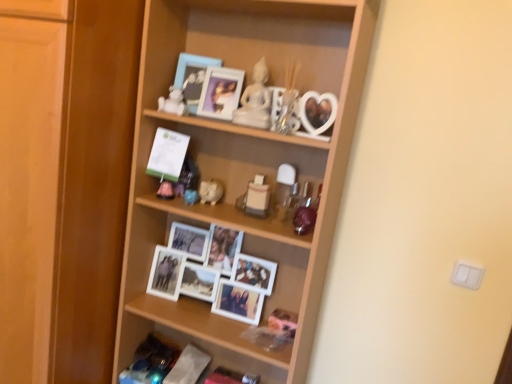
This screenshot has height=384, width=512. What do you see at coordinates (167, 154) in the screenshot?
I see `green paper at center` at bounding box center [167, 154].

Where is `green paper at center`? The height and width of the screenshot is (384, 512). green paper at center is located at coordinates (167, 154).

How much space does white glossy statue at upper center, which is counted as the 1th toy, starting from the top, occupy horizontally?

white glossy statue at upper center, which is counted as the 1th toy, starting from the top, is 1.99 inches in width.

At what (x,y) coordinates should I click in order to perform the action: click on matte plastic toy at center, which ranks as the 1th toy in bottom-to-top order. Please return your answer as a coordinate pair (x, y). The height and width of the screenshot is (384, 512). Looking at the image, I should click on (255, 198).

Locate an element on the screen. This screenshot has height=384, width=512. white matte figurine at upper center, which is counted as the 2th toy, starting from the top is located at coordinates (173, 102).

From the picture: From the image's perspective, between matte plastic toy at center, the third toy ordered from the bottom, and white glossy statue at upper center, the 5th toy positioned from the bottom, which one is located above?

white glossy statue at upper center, the 5th toy positioned from the bottom, from the image's perspective.

Which is correct: matte plastic toy at center, the third toy ordered from the bottom, is inside white glossy statue at upper center, which is counted as the 1th toy, starting from the top, or outside of it?

matte plastic toy at center, the third toy ordered from the bottom, exists outside the volume of white glossy statue at upper center, which is counted as the 1th toy, starting from the top.

Which is more to the left, matte plastic toy at center, the third toy ordered from the bottom, or white glossy statue at upper center, which is counted as the 1th toy, starting from the top?

matte plastic toy at center, the third toy ordered from the bottom, is more to the left.

Which is in front, point (183, 163) or point (267, 71)?

Point (267, 71)

Which is correct: wooden cabinet at left is inside matte plastic toy at center, the third toy ordered from the bottom, or outside of it?

The correct answer is: outside.

You are a GUI agent. You are given a task and a screenshot of the screen. Output one action in this format:
    pyautogui.click(x=<x>, y=<y>)
    Task: Click on the toy that is the 2nd object to the right of the wooden cabinet at left, starting at the anchor
    The image size is (512, 384).
    Given the screenshot: What is the action you would take?
    point(182,182)

From the picture: Is the depth of wooden cabinet at left less than that of matte plastic toy at center, the 3th toy when ordered from top to bottom?

Yes, it is in front of matte plastic toy at center, the 3th toy when ordered from top to bottom.

Is wooden cabinet at left not close to matte plastic toy at center, the 3th toy when ordered from top to bottom?

No, wooden cabinet at left is not far from matte plastic toy at center, the 3th toy when ordered from top to bottom.

Considering the positions of objects white glossy statue at upper center, the 5th toy positioned from the bottom, and wooden cabinet at left in the image provided, who is in front, white glossy statue at upper center, the 5th toy positioned from the bottom, or wooden cabinet at left?

wooden cabinet at left is in front.

Between white glossy statue at upper center, the 5th toy positioned from the bottom, and wooden cabinet at left, which one has less height?

Standing shorter between the two is white glossy statue at upper center, the 5th toy positioned from the bottom.

Is white glossy statue at upper center, which is counted as the 1th toy, starting from the top, bigger or smaller than wooden cabinet at left?

white glossy statue at upper center, which is counted as the 1th toy, starting from the top, is smaller than wooden cabinet at left.

Is the surface of matte plastic picture frame at upper center, which is counted as the 1th picture frame, starting from the right, in direct contact with white glossy piggy bank at center, the second toy positioned from the bottom?

matte plastic picture frame at upper center, which is counted as the 1th picture frame, starting from the right, and white glossy piggy bank at center, the second toy positioned from the bottom, are clearly separated.

How far apart are matte plastic picture frame at upper center, marked as the second picture frame in a left-to-right arrangement, and white glossy piggy bank at center, the second toy positioned from the bottom?

11.71 inches.

From a real-world perspective, which is physically above, matte plastic picture frame at upper center, marked as the second picture frame in a left-to-right arrangement, or white glossy piggy bank at center, placed as the 4th toy when sorted from top to bottom?

In real-world perspective, matte plastic picture frame at upper center, marked as the second picture frame in a left-to-right arrangement, is above.

Considering the sizes of matte blue picture frame at upper center, which is the second picture frame from right to left, and white glossy piggy bank at center, the second toy positioned from the bottom, in the image, is matte blue picture frame at upper center, which is the second picture frame from right to left, taller or shorter than white glossy piggy bank at center, the second toy positioned from the bottom,?

In the image, matte blue picture frame at upper center, which is the second picture frame from right to left, appears to be taller than white glossy piggy bank at center, the second toy positioned from the bottom.

Starting from the matte blue picture frame at upper center, which is the second picture frame from right to left, which toy is the 1st one to the right? Please provide its 2D coordinates.

[(211, 191)]

From a real-world perspective, which is physically below, wooden cabinet at left or wooden shelf at center, which is counted as the 1th shelf, starting from the top?

wooden cabinet at left is physically lower.

Considering the sizes of wooden cabinet at left and wooden shelf at center, marked as the second shelf in a bottom-to-top arrangement, in the image, is wooden cabinet at left taller or shorter than wooden shelf at center, marked as the second shelf in a bottom-to-top arrangement,?

Considering their sizes, wooden cabinet at left has more height than wooden shelf at center, marked as the second shelf in a bottom-to-top arrangement.

Is wooden cabinet at left inside or outside of wooden shelf at center, which is counted as the 1th shelf, starting from the top?

wooden cabinet at left lies outside wooden shelf at center, which is counted as the 1th shelf, starting from the top.

Is there a large distance between wooden cabinet at left and wooden shelf at center, marked as the second shelf in a bottom-to-top arrangement?

No, wooden cabinet at left is not far from wooden shelf at center, marked as the second shelf in a bottom-to-top arrangement.

Does matte plastic toy at center, acting as the 5th toy starting from the top, have a greater height compared to matte blue picture frame at upper center, which is the second picture frame from right to left?

No.

From the image's perspective, is matte plastic toy at center, which ranks as the 1th toy in bottom-to-top order, located beneath matte blue picture frame at upper center, the 1th picture frame from the left?

Yes, from the image's perspective, matte plastic toy at center, which ranks as the 1th toy in bottom-to-top order, is beneath matte blue picture frame at upper center, the 1th picture frame from the left.

What's the angular difference between matte plastic toy at center, acting as the 5th toy starting from the top, and matte blue picture frame at upper center, which is the second picture frame from right to left,'s facing directions?

They differ by 18.3 degrees in their facing directions.

Is matte plastic toy at center, which ranks as the 1th toy in bottom-to-top order, facing towards matte blue picture frame at upper center, which is the second picture frame from right to left?

No, matte plastic toy at center, which ranks as the 1th toy in bottom-to-top order, is not turned towards matte blue picture frame at upper center, which is the second picture frame from right to left.

Which toy is the 4th one when counting from the back of the white glossy statue at upper center, the 5th toy positioned from the bottom? Please provide its 2D coordinates.

[(182, 182)]

Find the location of `cabinetry located underneath the matte plastic toy at center, the 3th toy when ordered from top to bottom (from a real-world perspective)`. cabinetry located underneath the matte plastic toy at center, the 3th toy when ordered from top to bottom (from a real-world perspective) is located at coordinates (64, 183).

Considering their positions, is green paper at center positioned closer to wooden cabinet at left than matte plastic toy at center, the 3th toy when ordered from top to bottom?

green paper at center is closer to wooden cabinet at left.

Based on their spatial positions, is white matte figurine at upper center, which ranks as the 4th toy in bottom-to-top order, or matte blue picture frame at upper center, which is the second picture frame from right to left, closer to white glossy statue at upper center, which is counted as the 1th toy, starting from the top?

matte blue picture frame at upper center, which is the second picture frame from right to left, is positioned closer to the anchor white glossy statue at upper center, which is counted as the 1th toy, starting from the top.

Based on their spatial positions, is white matte photo frames at center, the 2th shelf from the top, or white glossy piggy bank at center, placed as the 4th toy when sorted from top to bottom, closer to white matte figurine at upper center, which ranks as the 4th toy in bottom-to-top order?

white glossy piggy bank at center, placed as the 4th toy when sorted from top to bottom, is positioned closer to the anchor white matte figurine at upper center, which ranks as the 4th toy in bottom-to-top order.

When comparing their distances from matte plastic toy at center, which ranks as the 1th toy in bottom-to-top order, does matte blue picture frame at upper center, which is the second picture frame from right to left, or green paper at center seem further?

matte blue picture frame at upper center, which is the second picture frame from right to left, lies further to matte plastic toy at center, which ranks as the 1th toy in bottom-to-top order, than the other object.

Looking at this image, estimate the real-world distances between objects in this image. Which object is further from green paper at center, wooden shelf at center, marked as the second shelf in a bottom-to-top arrangement, or wooden cabinet at left?

wooden shelf at center, marked as the second shelf in a bottom-to-top arrangement, is positioned further to the anchor green paper at center.

Based on their spatial positions, is white glossy piggy bank at center, placed as the 4th toy when sorted from top to bottom, or white matte photo frames at center, which ranks as the first shelf in bottom-to-top order, further from matte plastic toy at center, the third toy ordered from the bottom?

white matte photo frames at center, which ranks as the first shelf in bottom-to-top order, lies further to matte plastic toy at center, the third toy ordered from the bottom, than the other object.

From the image, which object appears to be nearer to matte plastic picture frame at upper center, marked as the second picture frame in a left-to-right arrangement, white glossy piggy bank at center, placed as the 4th toy when sorted from top to bottom, or matte plastic toy at center, acting as the 5th toy starting from the top?

Based on the image, matte plastic toy at center, acting as the 5th toy starting from the top, appears to be nearer to matte plastic picture frame at upper center, marked as the second picture frame in a left-to-right arrangement.

Considering their positions, is wooden cabinet at left positioned closer to matte plastic toy at center, acting as the 5th toy starting from the top, than matte plastic picture frame at upper center, which is counted as the 1th picture frame, starting from the right?

The object closer to matte plastic toy at center, acting as the 5th toy starting from the top, is matte plastic picture frame at upper center, which is counted as the 1th picture frame, starting from the right.

You are a GUI agent. You are given a task and a screenshot of the screen. Output one action in this format:
    pyautogui.click(x=<x>, y=<y>)
    Task: Click on the picture frame between matte blue picture frame at upper center, the 1th picture frame from the left, and white matte photo frames at center, which ranks as the first shelf in bottom-to-top order, from top to bottom
    
    Given the screenshot: What is the action you would take?
    pyautogui.click(x=220, y=93)

You are a GUI agent. You are given a task and a screenshot of the screen. Output one action in this format:
    pyautogui.click(x=<x>, y=<y>)
    Task: Click on the postcard between wooden cabinet at left and white matte figurine at upper center, which ranks as the 4th toy in bottom-to-top order, from left to right
    
    Given the screenshot: What is the action you would take?
    pyautogui.click(x=167, y=154)

This screenshot has height=384, width=512. In order to click on shelf located between wooden cabinet at left and wooden shelf at center, which is counted as the 1th shelf, starting from the top, in the left-right direction in this screenshot , I will do `click(205, 326)`.

At what (x,y) coordinates should I click in order to perform the action: click on picture frame that lies between matte blue picture frame at upper center, the 1th picture frame from the left, and matte plastic toy at center, the 3th toy when ordered from top to bottom, from top to bottom. Please return your answer as a coordinate pair (x, y). The height and width of the screenshot is (384, 512). Looking at the image, I should click on (220, 93).